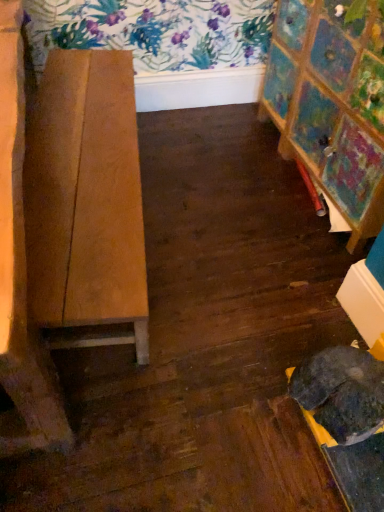
Locate an element on the screen. The height and width of the screenshot is (512, 384). free space above wooden table at left (from a real-world perspective) is located at coordinates (81, 139).